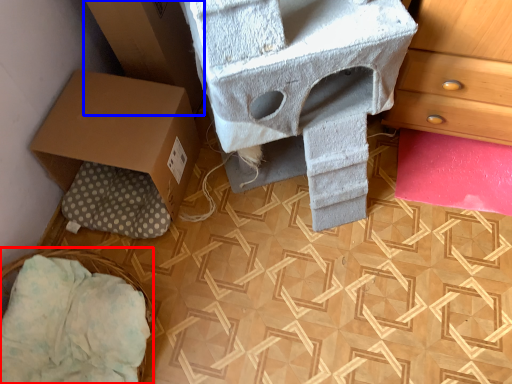
Question: Among these objects, which one is nearest to the camera, basket (highlighted by a red box) or cardboard box (highlighted by a blue box)?

Choices:
 (A) basket
 (B) cardboard box

Answer: (A)